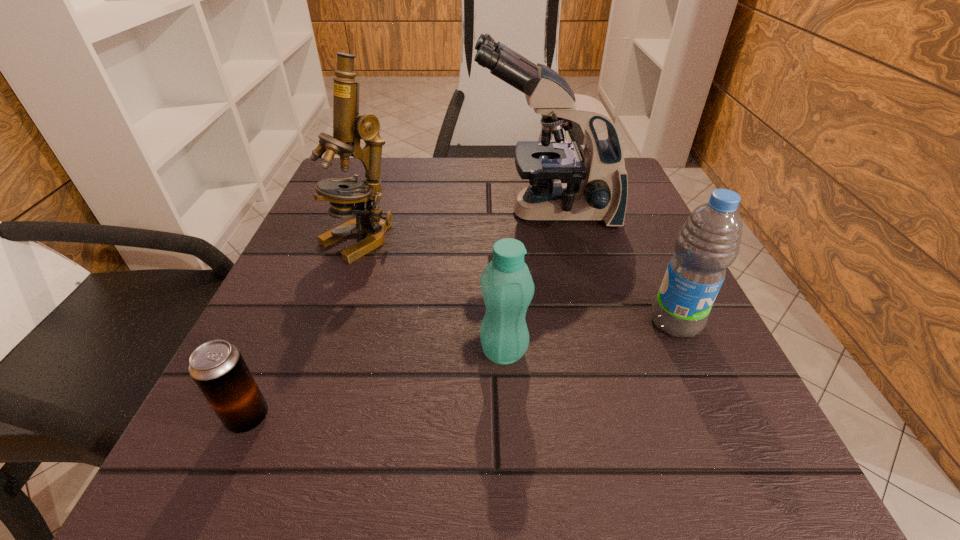
This screenshot has width=960, height=540. I want to click on the right microscope, so click(x=594, y=186).

Where is `the left microscope`? The height and width of the screenshot is (540, 960). the left microscope is located at coordinates (x=349, y=127).

Locate an element on the screen. This screenshot has width=960, height=540. the third tallest object is located at coordinates (709, 241).

This screenshot has height=540, width=960. I want to click on the second shortest object, so click(507, 287).

The height and width of the screenshot is (540, 960). In order to click on beer can in this screenshot , I will do `click(217, 367)`.

The width and height of the screenshot is (960, 540). What are the coordinates of `the nearest object` in the screenshot? It's located at (217, 367).

Find the location of a particular element. The image size is (960, 540). blank space located 0.170m through the eyepieces of the right microscope is located at coordinates (393, 213).

At what (x,y) coordinates should I click in order to perform the action: click on free space located 0.340m through the eyepieces of the right microscope. Please return your answer as a coordinate pair (x, y). This screenshot has width=960, height=540. Looking at the image, I should click on coord(311,213).

At what (x,y) coordinates should I click in order to perform the action: click on free region located 0.170m through the eyepieces of the right microscope. Please return your answer as a coordinate pair (x, y). Looking at the image, I should click on [393, 213].

Find the location of a particular element. free space located 0.230m on the right of the left microscope is located at coordinates (516, 240).